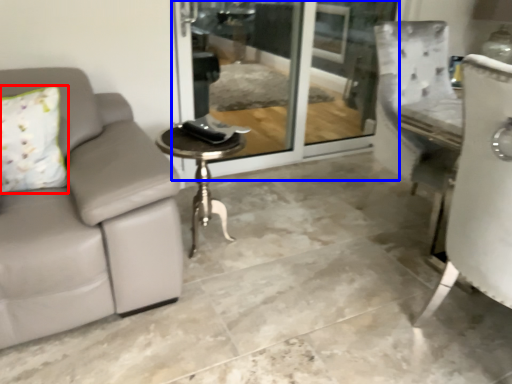
Question: Which object is closer to the camera taking this photo, pillow (highlighted by a red box) or screen door (highlighted by a blue box)?

Choices:
 (A) pillow
 (B) screen door

Answer: (A)